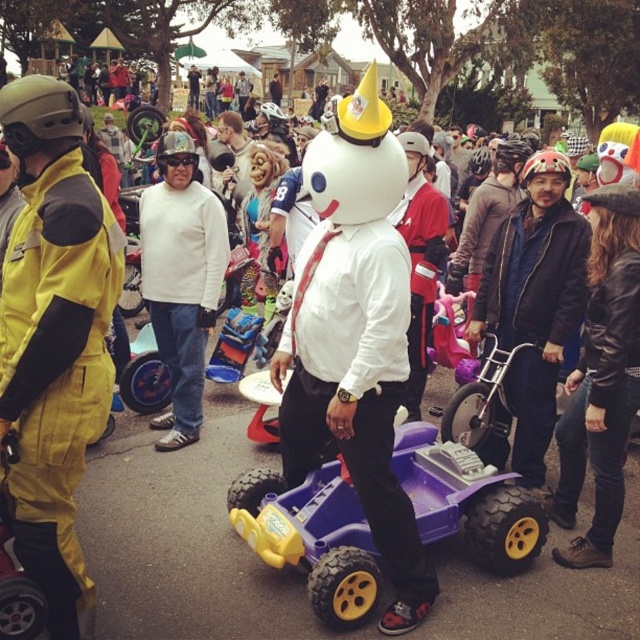
Which is above, matte purple plastic toy car at center or purple plastic toy car at center?

Positioned higher is purple plastic toy car at center.

Between matte purple plastic toy car at center and purple plastic toy car at center, which one is positioned lower?

matte purple plastic toy car at center is lower down.

The height and width of the screenshot is (640, 640). What do you see at coordinates (355, 336) in the screenshot?
I see `matte purple plastic toy car at center` at bounding box center [355, 336].

This screenshot has height=640, width=640. I want to click on matte purple plastic toy car at center, so click(x=355, y=336).

Does point (52, 394) come closer to viewer compared to point (237, 518)?

That is True.

Between yellow matte jumpsuit at left and purple plastic toy car at center, which one has less height?

purple plastic toy car at center is shorter.

Between point (13, 548) and point (339, 477), which one is positioned behind?

The point (339, 477) is behind.

Locate an element on the screen. yellow matte jumpsuit at left is located at coordinates (54, 369).

Which is in front, point (392, 184) or point (67, 573)?

Point (67, 573) is in front.

Can you confirm if matte purple plastic toy car at center is shorter than yellow matte jumpsuit at left?

Indeed, matte purple plastic toy car at center has a lesser height compared to yellow matte jumpsuit at left.

You are a GUI agent. You are given a task and a screenshot of the screen. Output one action in this format:
    pyautogui.click(x=<x>, y=<y>)
    Task: Click on the matte purple plastic toy car at center
    This screenshot has width=640, height=640.
    Given the screenshot: What is the action you would take?
    pyautogui.click(x=355, y=336)

You are a GUI agent. You are given a task and a screenshot of the screen. Output one action in this format:
    pyautogui.click(x=<x>, y=<y>)
    Task: Click on the matte purple plastic toy car at center
    The width and height of the screenshot is (640, 640).
    Given the screenshot: What is the action you would take?
    pyautogui.click(x=355, y=336)